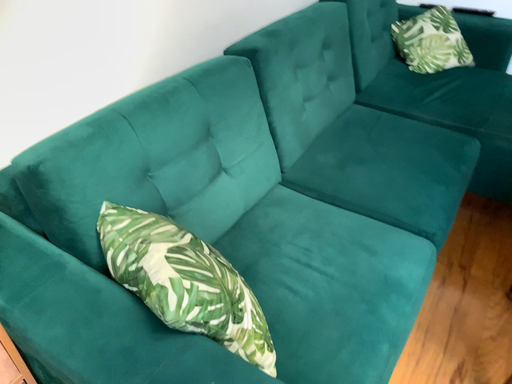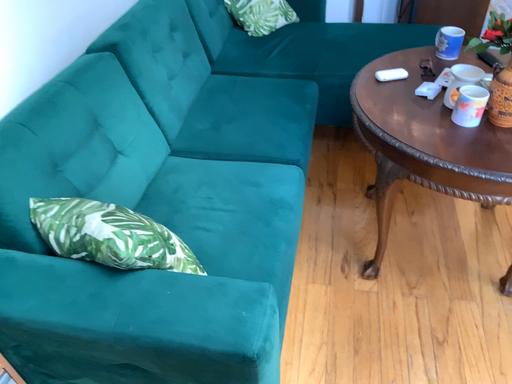
Question: Which way did the camera rotate in the video?

Choices:
 (A) rotated left
 (B) rotated right

Answer: (B)